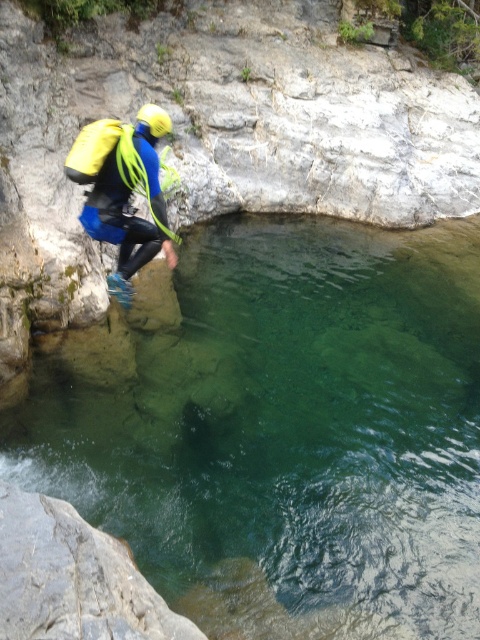
Question: Which object is farther from the camera taking this photo?

Choices:
 (A) yellow neoprene suit at left
 (B) gray rough rock at lower left
 (C) clear water at center

Answer: (A)

Question: Which object appears farthest from the camera in this image?

Choices:
 (A) yellow neoprene suit at left
 (B) gray rough rock at lower left
 (C) clear water at center

Answer: (A)

Question: Where is clear water at center located in relation to gray rough rock at lower left in the image?

Choices:
 (A) below
 (B) above

Answer: (B)

Question: Is the position of gray rough rock at lower left more distant than that of yellow neoprene suit at left?

Choices:
 (A) yes
 (B) no

Answer: (B)

Question: Observing the image, what is the correct spatial positioning of clear water at center in reference to gray rough rock at lower left?

Choices:
 (A) below
 (B) above

Answer: (B)

Question: Among these points, which one is nearest to the camera?

Choices:
 (A) (99, 189)
 (B) (79, 582)
 (C) (188, 499)

Answer: (B)